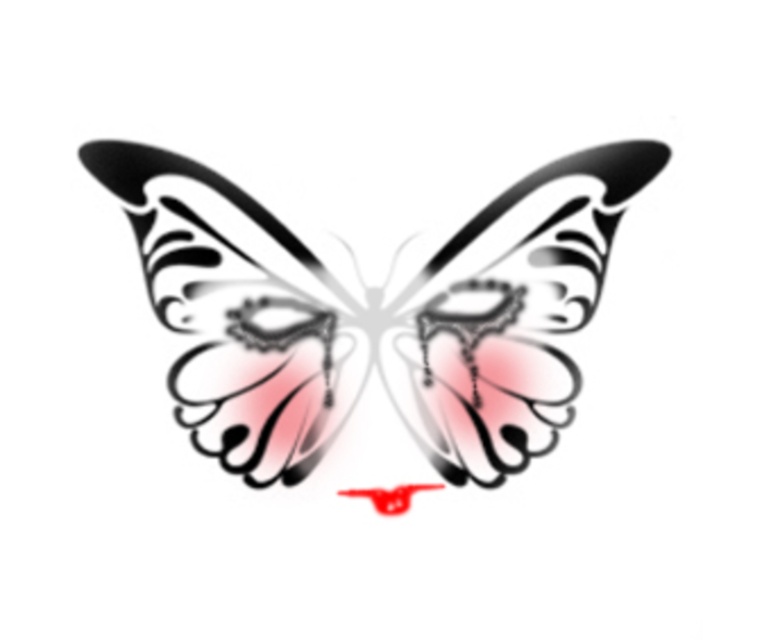
Question: Which point appears farthest from the camera in this image?

Choices:
 (A) (140, 188)
 (B) (251, 339)

Answer: (B)

Question: Which point is farther to the camera?

Choices:
 (A) (130, 200)
 (B) (550, 340)

Answer: (B)

Question: Considering the relative positions of translucent paper butterfly at center and black glossy wing at center in the image provided, where is translucent paper butterfly at center located with respect to black glossy wing at center?

Choices:
 (A) left
 (B) right

Answer: (B)

Question: Can you confirm if translucent paper butterfly at center is positioned above black glossy wing at center?

Choices:
 (A) no
 (B) yes

Answer: (A)

Question: Is translucent paper butterfly at center to the right of black glossy wing at center from the viewer's perspective?

Choices:
 (A) yes
 (B) no

Answer: (A)